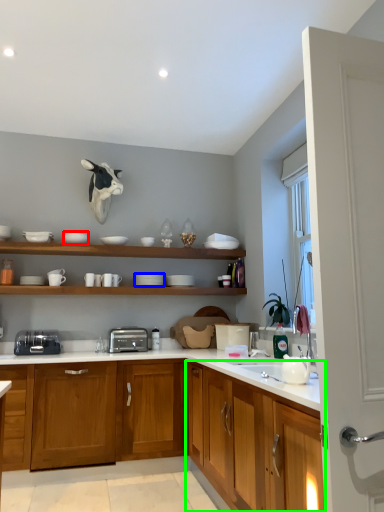
Question: Based on their relative distances, which object is nearer to tableware (highlighted by a red box)? Choose from tableware (highlighted by a blue box) and cabinetry (highlighted by a green box).

Choices:
 (A) tableware
 (B) cabinetry

Answer: (A)